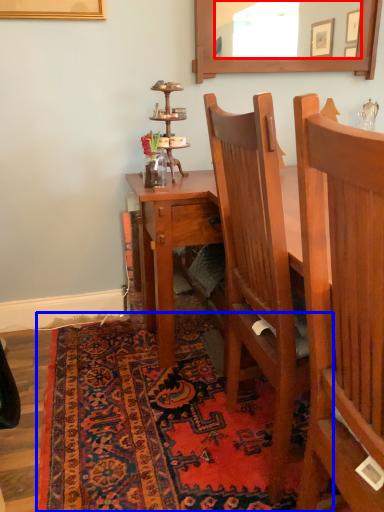
Question: Which object appears closest to the camera in this image, mirror (highlighted by a red box) or mat (highlighted by a blue box)?

Choices:
 (A) mirror
 (B) mat

Answer: (B)